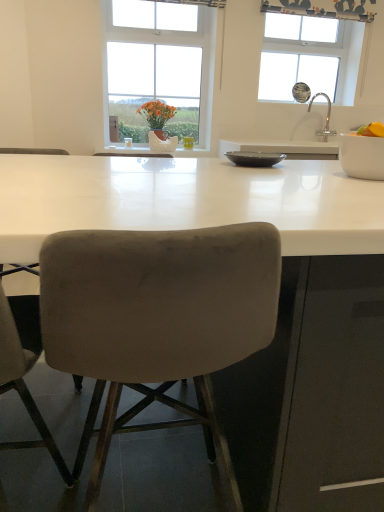
Question: Can you confirm if transparent glass window at upper right, marked as the second window in a left-to-right arrangement, is wider than orange matte at right?

Choices:
 (A) no
 (B) yes

Answer: (B)

Question: From a real-world perspective, is transparent glass window at upper right, marked as the second window in a left-to-right arrangement, over orange matte at right?

Choices:
 (A) yes
 (B) no

Answer: (A)

Question: From the image's perspective, is transparent glass window at upper right, marked as the second window in a left-to-right arrangement, located above orange matte at right?

Choices:
 (A) yes
 (B) no

Answer: (A)

Question: Considering the relative sizes of transparent glass window at upper right, marked as the first window in a right-to-left arrangement, and orange matte at right in the image provided, is transparent glass window at upper right, marked as the first window in a right-to-left arrangement, thinner than orange matte at right?

Choices:
 (A) no
 (B) yes

Answer: (A)

Question: Can you confirm if transparent glass window at upper right, marked as the second window in a left-to-right arrangement, is smaller than orange matte at right?

Choices:
 (A) no
 (B) yes

Answer: (A)

Question: Considering the relative sizes of transparent glass window at upper right, marked as the first window in a right-to-left arrangement, and orange matte at right in the image provided, is transparent glass window at upper right, marked as the first window in a right-to-left arrangement, taller than orange matte at right?

Choices:
 (A) yes
 (B) no

Answer: (A)

Question: Considering the relative sizes of transparent glass window at upper right, marked as the first window in a right-to-left arrangement, and white ceramic vase at center in the image provided, is transparent glass window at upper right, marked as the first window in a right-to-left arrangement, smaller than white ceramic vase at center?

Choices:
 (A) yes
 (B) no

Answer: (B)

Question: From a real-world perspective, is transparent glass window at upper right, marked as the first window in a right-to-left arrangement, positioned under white ceramic vase at center based on gravity?

Choices:
 (A) no
 (B) yes

Answer: (A)

Question: Is white ceramic vase at center located within transparent glass window at upper right, marked as the second window in a left-to-right arrangement?

Choices:
 (A) yes
 (B) no

Answer: (B)

Question: Does transparent glass window at upper right, marked as the first window in a right-to-left arrangement, have a lesser width compared to white ceramic vase at center?

Choices:
 (A) no
 (B) yes

Answer: (B)

Question: Can you confirm if transparent glass window at upper right, marked as the second window in a left-to-right arrangement, is wider than white ceramic vase at center?

Choices:
 (A) yes
 (B) no

Answer: (B)

Question: Does transparent glass window at upper right, marked as the second window in a left-to-right arrangement, have a greater height compared to white ceramic vase at center?

Choices:
 (A) yes
 (B) no

Answer: (A)

Question: Can you confirm if velvet beige chair at lower left, the second chair positioned from the right, is bigger than white glossy bowl at right, the 2th bowl from the back?

Choices:
 (A) yes
 (B) no

Answer: (A)